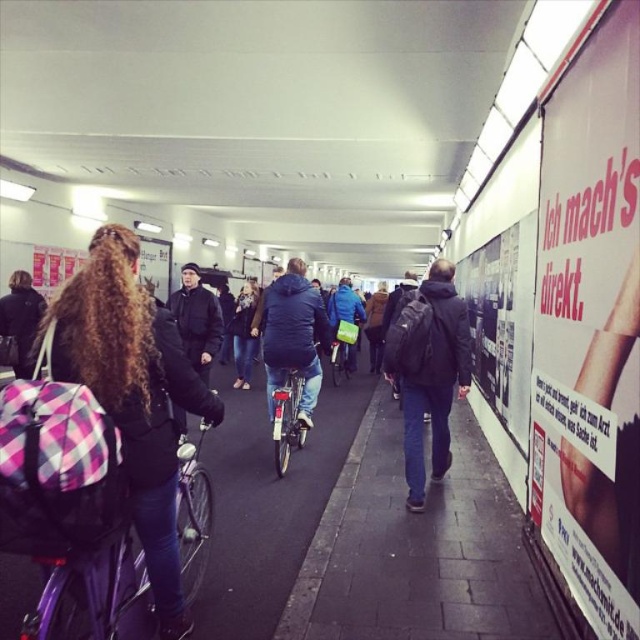
You are an urban planner analyzing traffic flow in this underpass. Considering the space each object takes up, which object between the shiny metallic bicycle at center and the blue fabric jacket at center would you prioritize to ensure smoother pedestrian movement?

The shiny metallic bicycle at center occupies less space than the blue fabric jacket at center, so prioritizing the removal or repositioning of the blue fabric jacket at center would likely improve pedestrian movement as it takes up more space.

You are a pedestrian trying to read the white paper advertisement at right while walking towards the metallic silver bicycle at center. Which direction should you turn your head to see both objects at the same time?

You should turn your head to the right to see both the white paper advertisement at right and the metallic silver bicycle at center since the advertisement is located to the right of the bicycle.